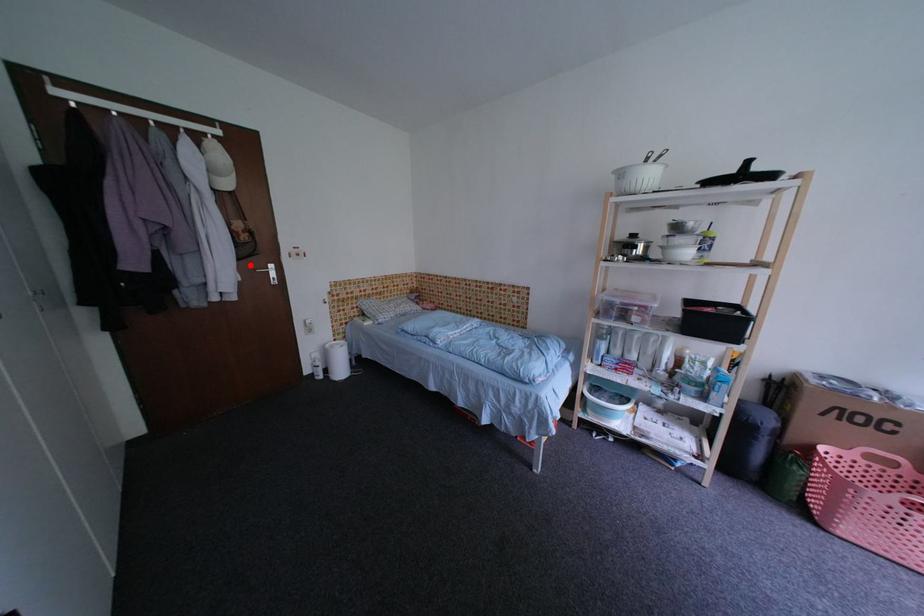
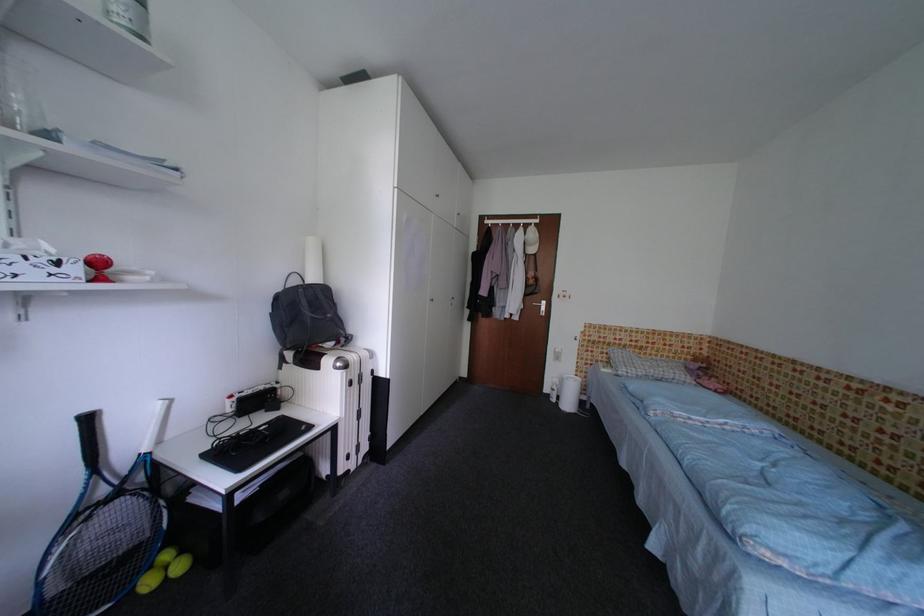
Locate, in the second image, the point that corresponds to the highlighted location in the first image.

(536, 300)